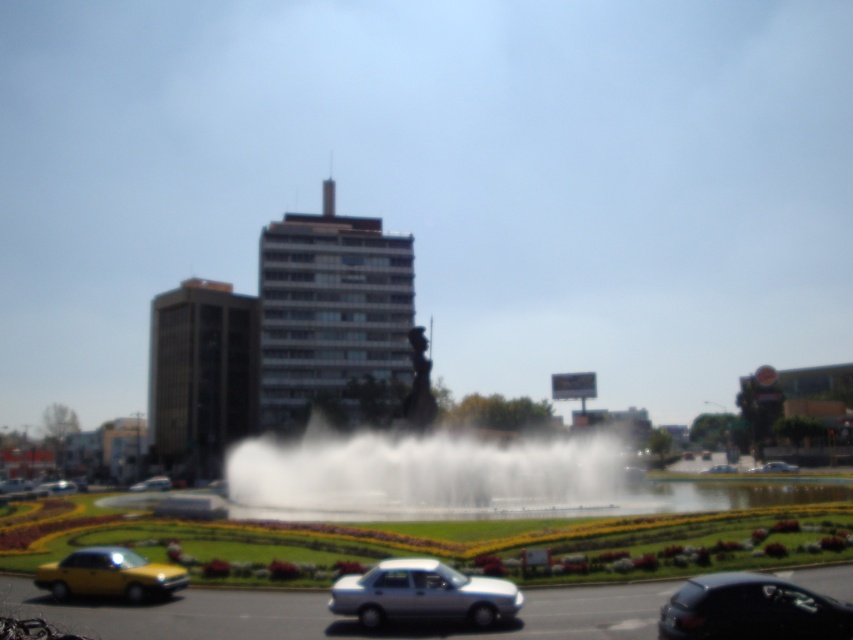
Question: Considering the real-world distances, which object is farthest from the white glossy sedan at center?

Choices:
 (A) yellow matte car at lower left
 (B) white mist at center
 (C) metallic silver sedan at center
 (D) yellow matte car at center

Answer: (A)

Question: Is yellow matte car at lower left positioned behind metallic silver sedan at center?

Choices:
 (A) no
 (B) yes

Answer: (A)

Question: Is shiny black sedan at lower right positioned behind yellow matte car at lower left?

Choices:
 (A) yes
 (B) no

Answer: (B)

Question: Which point is closer to the camera taking this photo?

Choices:
 (A) (361, 611)
 (B) (688, 595)
 (C) (62, 486)

Answer: (B)

Question: Is white mist at center above silver metallic sedan at lower center?

Choices:
 (A) yes
 (B) no

Answer: (B)

Question: Among these points, which one is farthest from the camera?

Choices:
 (A) 160,480
 (B) 813,627
 (C) 445,497

Answer: (A)